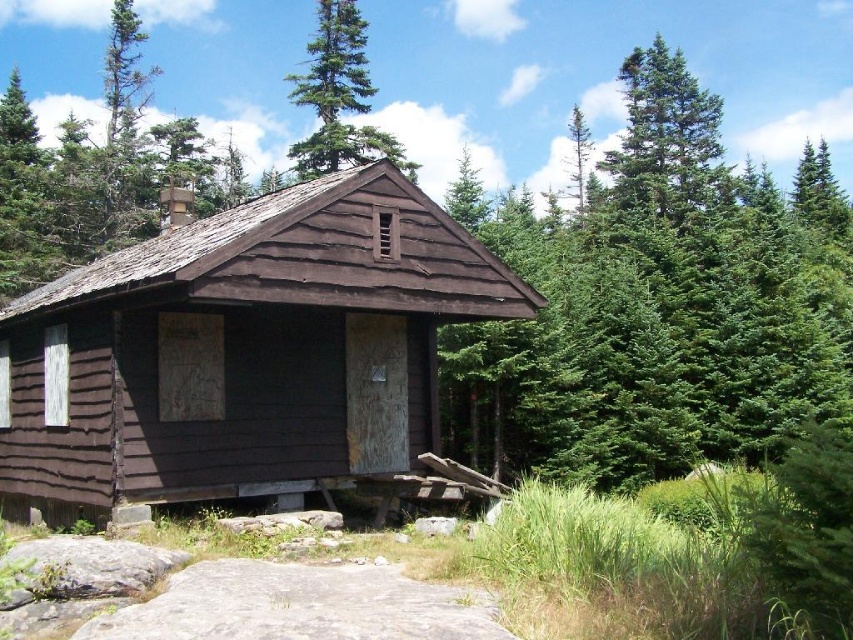
You are standing in the forest and see the brown wooden cabin at center and the green evergreen tree at center. Which object is nearer to you?

The brown wooden cabin at center is closer to the viewer than the green evergreen tree at center.